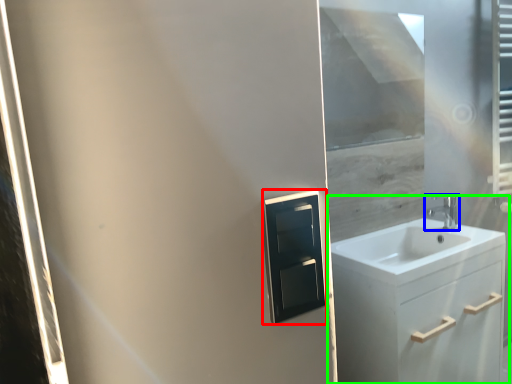
Question: Which object is the farthest from medicine cabinet (highlighted by a red box)? Choose among these: tap (highlighted by a blue box) or bathroom cabinet (highlighted by a green box).

Choices:
 (A) tap
 (B) bathroom cabinet

Answer: (A)